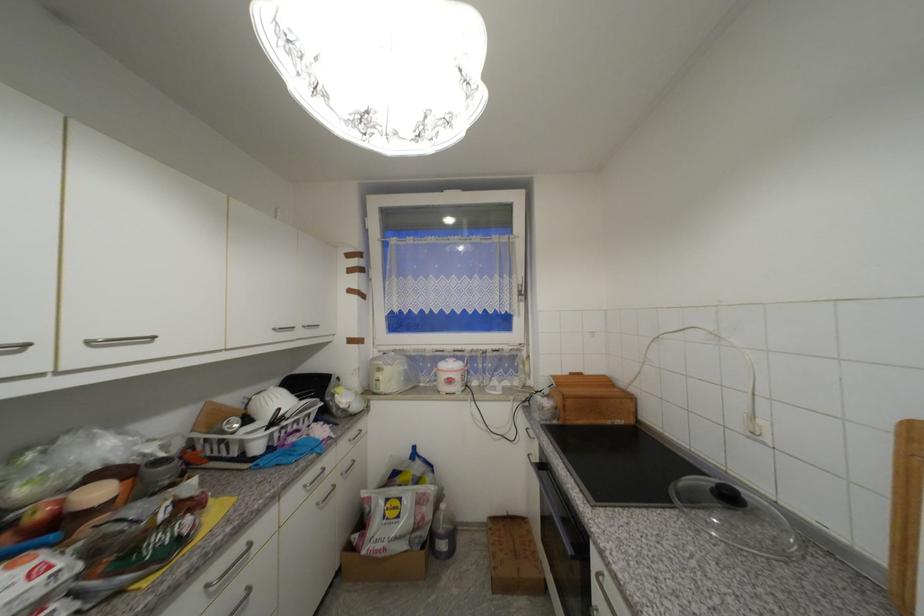
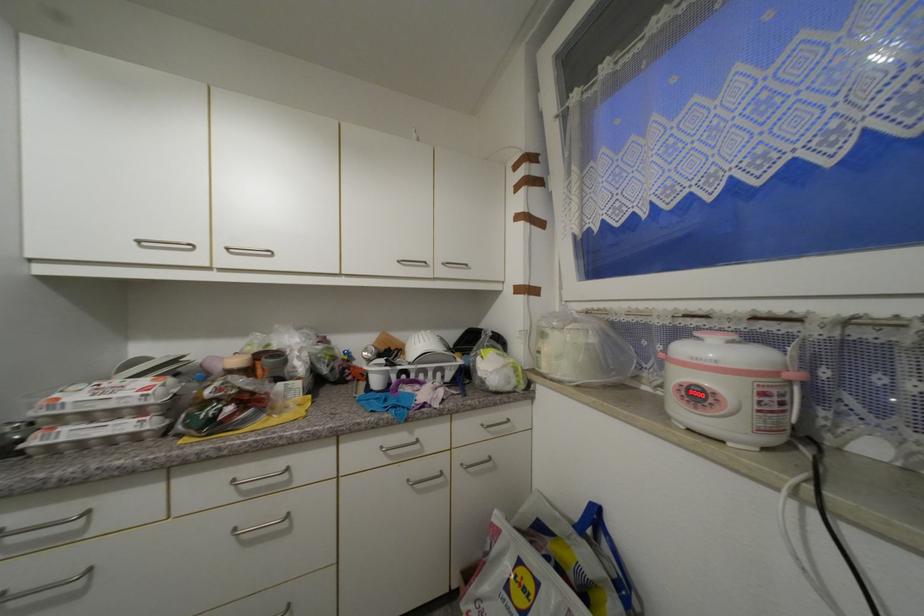
Where in the second image is the point corresponding to (x=471, y=370) from the first image?

(799, 378)